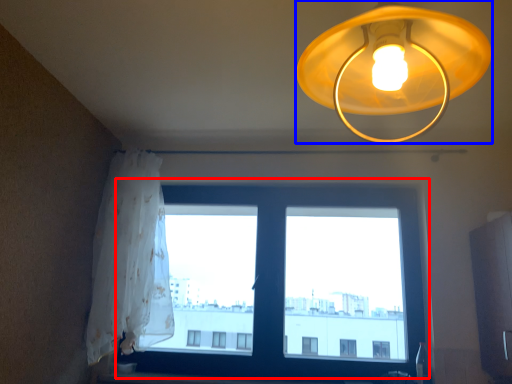
Question: Which point is further to the camera, window (highlighted by a red box) or lamp (highlighted by a blue box)?

Choices:
 (A) window
 (B) lamp

Answer: (A)